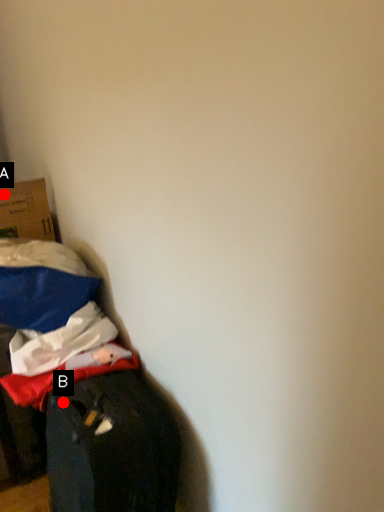
Question: Two points are circled on the image, labeled by A and B beside each circle. Among these points, which one is nearest to the camera?

Choices:
 (A) A is closer
 (B) B is closer

Answer: (B)